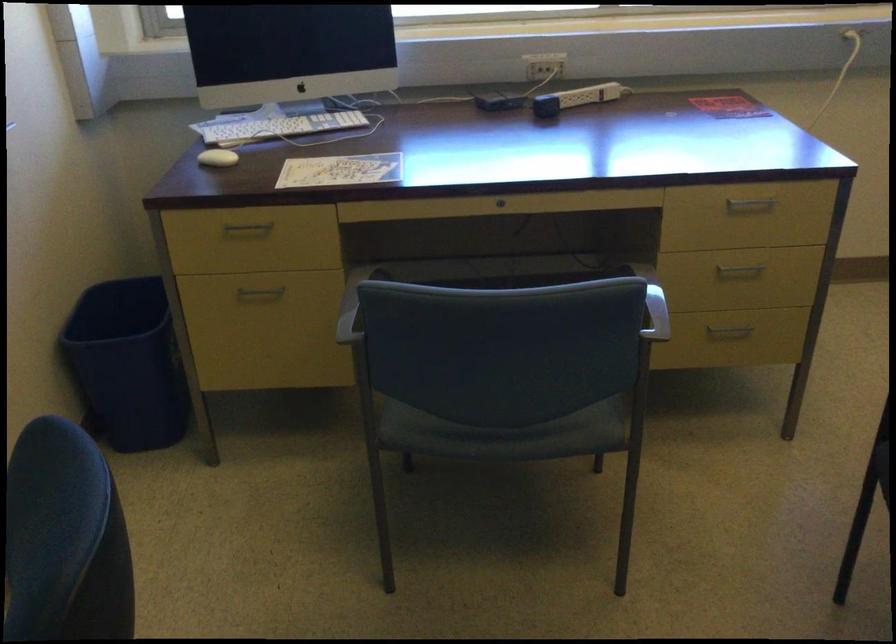
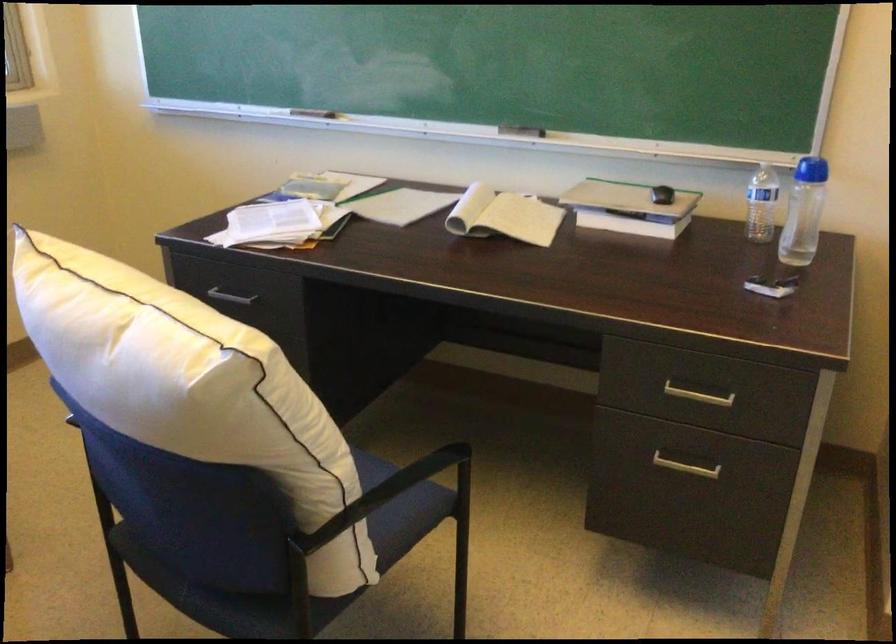
Question: The camera is either moving clockwise (left) or counter-clockwise (right) around the object. The first image is from the beginning of the video and the second image is from the end. Is the camera moving left or right when shooting the video?

Choices:
 (A) Left
 (B) Right

Answer: (A)